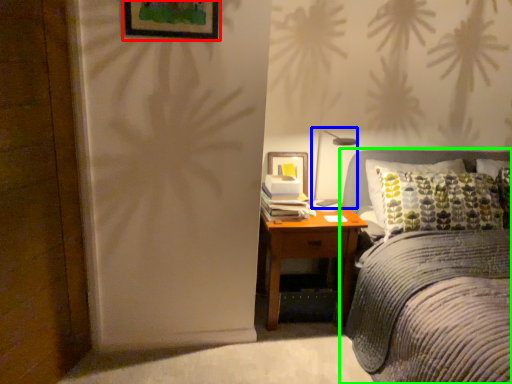
Question: Which is farther away from picture frame (highlighted by a red box)? bedside lamp (highlighted by a blue box) or bed (highlighted by a green box)?

Choices:
 (A) bedside lamp
 (B) bed

Answer: (B)